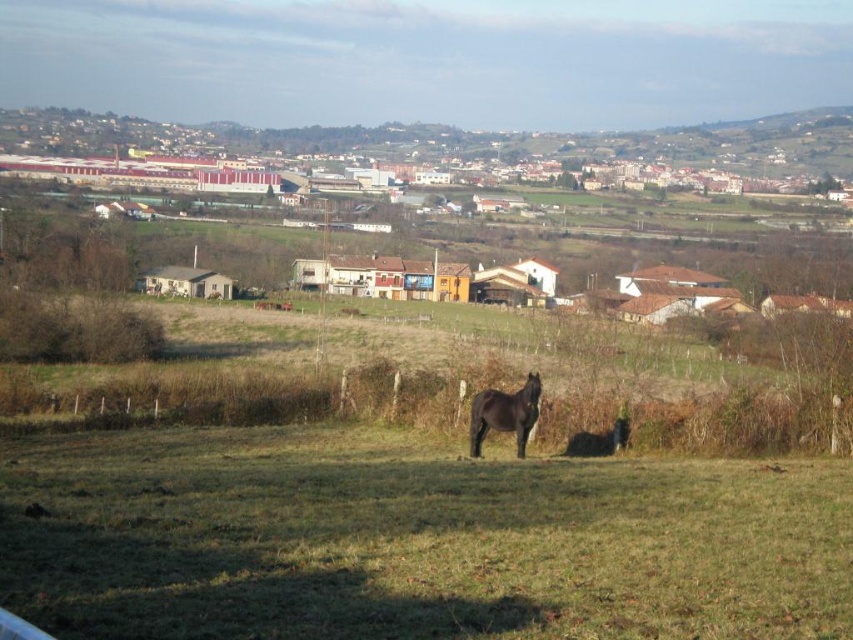
Question: Is green grassy field at center wider than black glossy horse at center?

Choices:
 (A) no
 (B) yes

Answer: (B)

Question: Is green grassy field at center positioned in front of black glossy horse at center?

Choices:
 (A) no
 (B) yes

Answer: (B)

Question: Which point is closer to the camera?

Choices:
 (A) (265, 480)
 (B) (521, 435)

Answer: (A)

Question: Which point is farther to the camera?

Choices:
 (A) green grassy field at center
 (B) black glossy horse at center

Answer: (B)

Question: Can you confirm if green grassy field at center is positioned below black glossy horse at center?

Choices:
 (A) no
 (B) yes

Answer: (B)